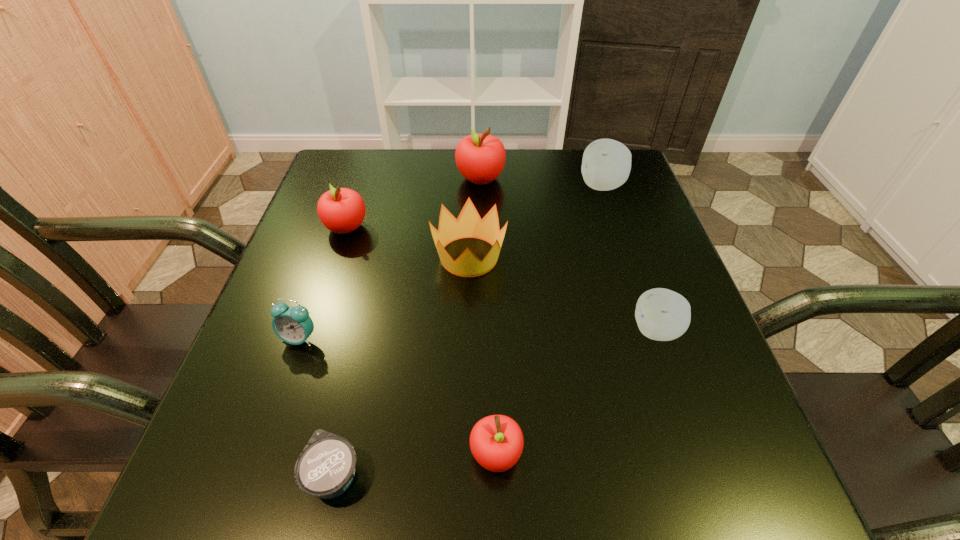
Identify the location of the smallest red apple. (496, 442).

I want to click on the sixth object from right to left, so click(x=325, y=468).

Where is `the shortest object`? This screenshot has width=960, height=540. the shortest object is located at coordinates (325, 468).

What are the coordinates of `vacant space situated on the back of the tallest apple` in the screenshot? It's located at (480, 154).

Find the location of a particular element. vacant space located on the front of the bigger white apple is located at coordinates (634, 279).

Locate an element on the screen. free space located 0.240m on the back of the second farthest red apple is located at coordinates (369, 159).

Find the location of `vacant region located on the back of the gold crown`. vacant region located on the back of the gold crown is located at coordinates (471, 148).

This screenshot has width=960, height=540. In order to click on vacant point located 0.070m on the face of the alarm clock in this screenshot , I will do [283, 384].

Where is `vacant space located 0.250m on the back of the fourth farthest apple`? This screenshot has height=540, width=960. vacant space located 0.250m on the back of the fourth farthest apple is located at coordinates (620, 227).

Image resolution: width=960 pixels, height=540 pixels. Find the location of `vacant space located 0.180m on the left of the smallest red apple`. vacant space located 0.180m on the left of the smallest red apple is located at coordinates (347, 454).